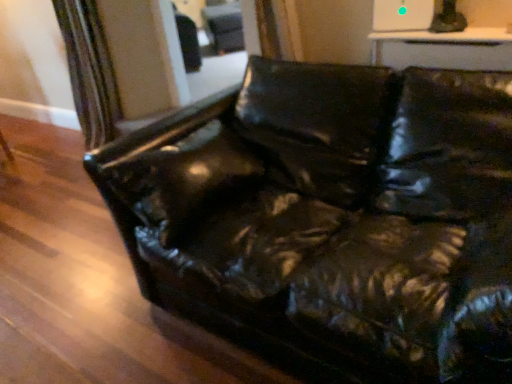
Question: Is black leather swivel chair at upper center shorter than shiny black leather couch at center?

Choices:
 (A) yes
 (B) no

Answer: (A)

Question: Does black leather swivel chair at upper center have a lesser width compared to shiny black leather couch at center?

Choices:
 (A) no
 (B) yes

Answer: (B)

Question: Considering the relative sizes of black leather swivel chair at upper center and shiny black leather couch at center in the image provided, is black leather swivel chair at upper center taller than shiny black leather couch at center?

Choices:
 (A) yes
 (B) no

Answer: (B)

Question: From the image's perspective, is black leather swivel chair at upper center located above shiny black leather couch at center?

Choices:
 (A) no
 (B) yes

Answer: (B)

Question: Is black leather swivel chair at upper center behind shiny black leather couch at center?

Choices:
 (A) no
 (B) yes

Answer: (B)

Question: Is black leather swivel chair at upper center to the right of shiny black leather couch at center from the viewer's perspective?

Choices:
 (A) no
 (B) yes

Answer: (A)

Question: Does shiny black leather couch at center appear on the right side of black leather swivel chair at upper center?

Choices:
 (A) yes
 (B) no

Answer: (A)

Question: Can you confirm if shiny black leather couch at center is smaller than black leather swivel chair at upper center?

Choices:
 (A) no
 (B) yes

Answer: (A)

Question: Is shiny black leather couch at center positioned behind black leather swivel chair at upper center?

Choices:
 (A) yes
 (B) no

Answer: (B)

Question: From the image's perspective, is shiny black leather couch at center over black leather swivel chair at upper center?

Choices:
 (A) no
 (B) yes

Answer: (A)

Question: Is shiny black leather couch at center wider than black leather swivel chair at upper center?

Choices:
 (A) yes
 (B) no

Answer: (A)

Question: Is shiny black leather couch at center positioned with its back to black leather swivel chair at upper center?

Choices:
 (A) no
 (B) yes

Answer: (A)

Question: Is black leather swivel chair at upper center spatially inside shiny black leather couch at center, or outside of it?

Choices:
 (A) inside
 (B) outside

Answer: (B)